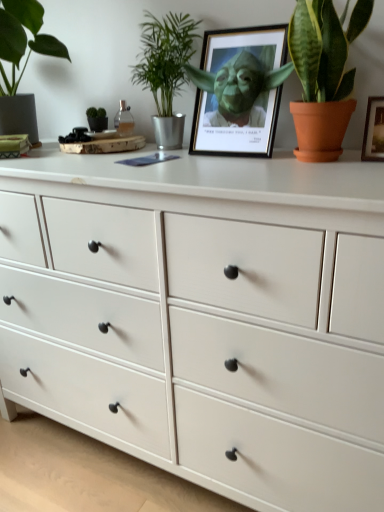
Question: Is green leafy plant at upper center, marked as the 2th houseplant in a right-to-left arrangement, oriented away from green matte plant at left, the first houseplant from the left?

Choices:
 (A) yes
 (B) no

Answer: (B)

Question: Is green leafy plant at upper center, acting as the 2th houseplant starting from the left, to the right of green matte plant at left, the first houseplant from the left, from the viewer's perspective?

Choices:
 (A) yes
 (B) no

Answer: (A)

Question: Would you consider green leafy plant at upper center, acting as the 2th houseplant starting from the left, to be distant from green matte plant at left, positioned as the third houseplant in right-to-left order?

Choices:
 (A) no
 (B) yes

Answer: (A)

Question: Can you confirm if green leafy plant at upper center, marked as the 2th houseplant in a right-to-left arrangement, is bigger than green matte plant at left, the first houseplant from the left?

Choices:
 (A) no
 (B) yes

Answer: (A)

Question: Is green leafy plant at upper center, marked as the 2th houseplant in a right-to-left arrangement, oriented towards green matte plant at left, the first houseplant from the left?

Choices:
 (A) yes
 (B) no

Answer: (B)

Question: From a real-world perspective, does green leafy plant at upper center, acting as the 2th houseplant starting from the left, stand above green matte plant at left, the first houseplant from the left?

Choices:
 (A) no
 (B) yes

Answer: (A)

Question: Considering the relative sizes of green leafy plant at upper center, acting as the 2th houseplant starting from the left, and white wood chest of drawers at center in the image provided, is green leafy plant at upper center, acting as the 2th houseplant starting from the left, wider than white wood chest of drawers at center?

Choices:
 (A) yes
 (B) no

Answer: (B)

Question: Considering the relative positions of green leafy plant at upper center, acting as the 2th houseplant starting from the left, and white wood chest of drawers at center in the image provided, is green leafy plant at upper center, acting as the 2th houseplant starting from the left, in front of white wood chest of drawers at center?

Choices:
 (A) no
 (B) yes

Answer: (A)

Question: Is white wood chest of drawers at center inside green leafy plant at upper center, acting as the 2th houseplant starting from the left?

Choices:
 (A) no
 (B) yes

Answer: (A)

Question: Does green leafy plant at upper center, acting as the 2th houseplant starting from the left, have a larger size compared to white wood chest of drawers at center?

Choices:
 (A) yes
 (B) no

Answer: (B)

Question: Can we say green leafy plant at upper center, acting as the 2th houseplant starting from the left, lies outside white wood chest of drawers at center?

Choices:
 (A) no
 (B) yes

Answer: (B)

Question: Can you confirm if green leafy plant at upper center, acting as the 2th houseplant starting from the left, is positioned to the left of white wood chest of drawers at center?

Choices:
 (A) no
 (B) yes

Answer: (B)

Question: Is white wood chest of drawers at center facing towards matte black picture frame at center?

Choices:
 (A) yes
 (B) no

Answer: (B)